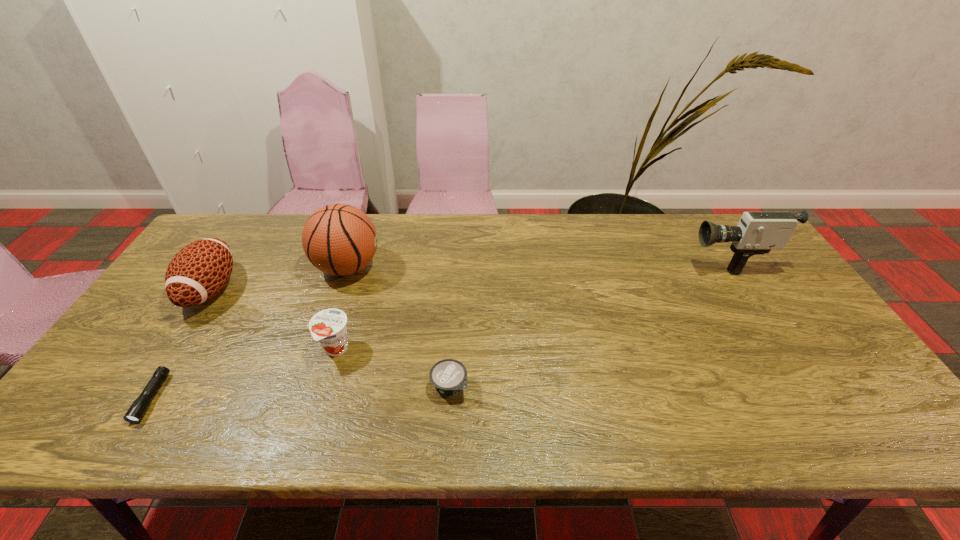
Identify the location of object that is at the right edge. (757, 233).

Where is `object present at the near left corner`? This screenshot has width=960, height=540. object present at the near left corner is located at coordinates (137, 410).

Find the location of a particular element. This screenshot has width=960, height=540. object located at the far right corner is located at coordinates (757, 233).

You are a GUI agent. You are given a task and a screenshot of the screen. Output one action in this format:
    pyautogui.click(x=<x>, y=<y>)
    Task: Click on the free space at the far edge
    
    Given the screenshot: What is the action you would take?
    pyautogui.click(x=266, y=236)

Locate an element on the screen. vacant space at the near edge of the desktop is located at coordinates (814, 431).

Where is `free space at the right edge of the desktop`? This screenshot has height=540, width=960. free space at the right edge of the desktop is located at coordinates (831, 338).

This screenshot has height=540, width=960. In order to click on vacant space at the far left corner of the desktop in this screenshot , I will do `click(247, 216)`.

In the image, there is a desktop. Where is `vacant space at the near right corner`? vacant space at the near right corner is located at coordinates (848, 411).

Identify the location of unoccupied area between the flashlight and the nearer yogurt. (300, 392).

Identify the location of vacant space in between the right yogurt and the basketball. (398, 327).